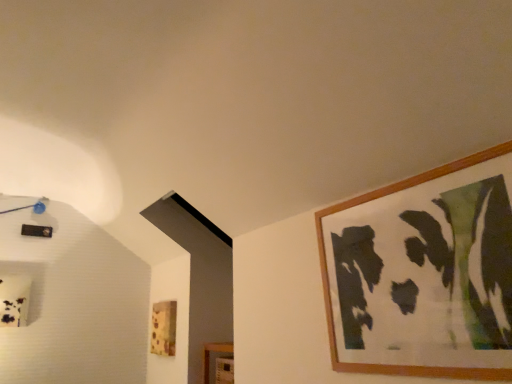
Question: In terms of size, does wooden picture frame at upper right, arranged as the 1th picture frame when viewed from the top, appear bigger or smaller than wooden picture frame at lower center, which is counted as the first picture frame, starting from the bottom?

Choices:
 (A) small
 (B) big

Answer: (B)

Question: Is wooden picture frame at upper right, the second picture frame when ordered from bottom to top, wider or thinner than wooden picture frame at lower center, which appears as the first picture frame when viewed from the back?

Choices:
 (A) wide
 (B) thin

Answer: (A)

Question: From their relative heights in the image, would you say wooden picture frame at upper right, which ranks as the second picture frame in back-to-front order, is taller or shorter than wooden picture frame at lower center, which is counted as the first picture frame, starting from the bottom?

Choices:
 (A) tall
 (B) short

Answer: (A)

Question: Looking at the image, does wooden picture frame at lower center, the 2th picture frame when ordered from front to back, seem bigger or smaller compared to wooden picture frame at upper right, the 1th picture frame viewed from the right?

Choices:
 (A) big
 (B) small

Answer: (B)

Question: From the image's perspective, is wooden picture frame at lower center, which is counted as the first picture frame, starting from the bottom, above or below wooden picture frame at upper right, the 2th picture frame in the left-to-right sequence?

Choices:
 (A) below
 (B) above

Answer: (A)

Question: In terms of width, does wooden picture frame at lower center, positioned as the first picture frame in left-to-right order, look wider or thinner when compared to wooden picture frame at upper right, positioned as the 1th picture frame in front-to-back order?

Choices:
 (A) thin
 (B) wide

Answer: (A)

Question: From a real-world perspective, relative to wooden picture frame at upper right, positioned as the 1th picture frame in front-to-back order, is wooden picture frame at lower center, which appears as the first picture frame when viewed from the back, vertically above or below?

Choices:
 (A) below
 (B) above

Answer: (A)